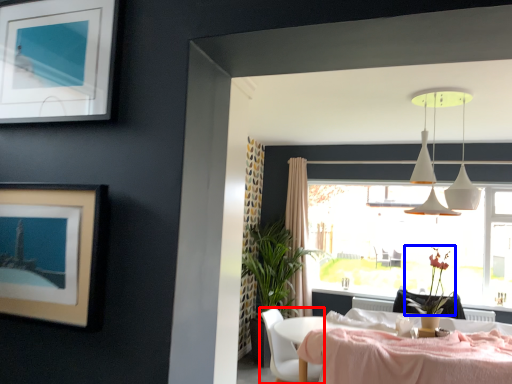
Question: Which of the following is the closest to the observer, chair (highlighted by a red box) or flower (highlighted by a blue box)?

Choices:
 (A) chair
 (B) flower

Answer: (A)